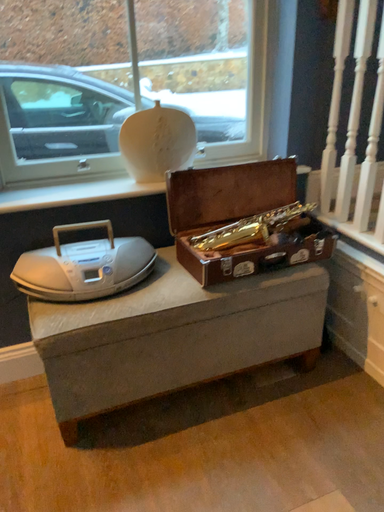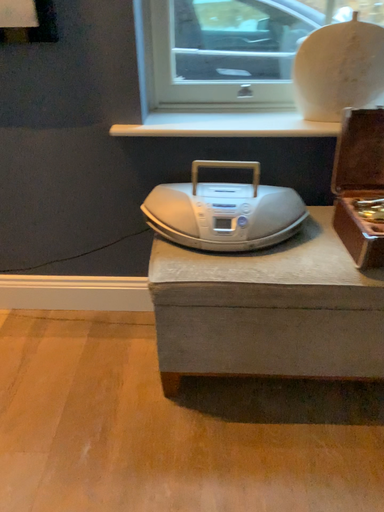
Question: Which way did the camera rotate in the video?

Choices:
 (A) rotated left
 (B) rotated right

Answer: (A)